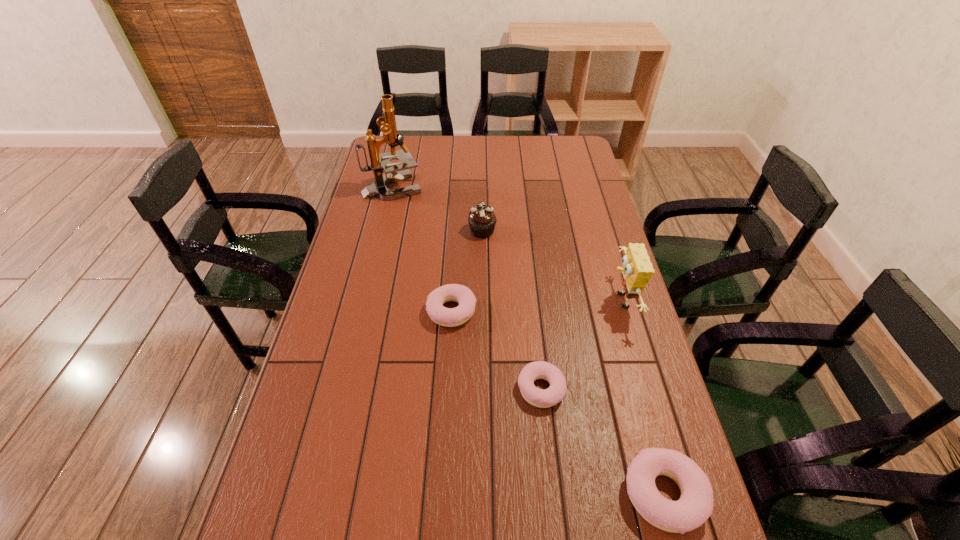
Where is `object at the left edge`? Image resolution: width=960 pixels, height=540 pixels. object at the left edge is located at coordinates (378, 162).

Locate an element on the screen. Image resolution: width=960 pixels, height=540 pixels. doughnut located at the right edge is located at coordinates (695, 506).

You are a GUI agent. You are given a task and a screenshot of the screen. Output one action in this format:
    pyautogui.click(x=<x>, y=<y>)
    Task: Click on the sponge at the right edge
    The image size is (960, 540).
    Given the screenshot: What is the action you would take?
    tap(637, 270)

Find the location of a particular element. The width and height of the screenshot is (960, 540). object that is at the near right corner is located at coordinates (695, 506).

Where is `vacant area at the far edge`? The width and height of the screenshot is (960, 540). vacant area at the far edge is located at coordinates (420, 159).

Locate an element on the screen. The image size is (960, 540). free space at the left edge of the desktop is located at coordinates (334, 436).

What are the coordinates of `blank space at the right edge` in the screenshot? It's located at (x=589, y=303).

I want to click on unoccupied area between the second tallest doughnut and the leftmost object, so [422, 249].

Locate an element on the screen. This screenshot has height=540, width=960. unoccupied area between the fifth nearest object and the fifth tallest object is located at coordinates (468, 271).

Find the location of a particular element. Image resolution: width=960 pixels, height=540 pixels. free space between the second tallest object and the second doughnut from left to right is located at coordinates (581, 345).